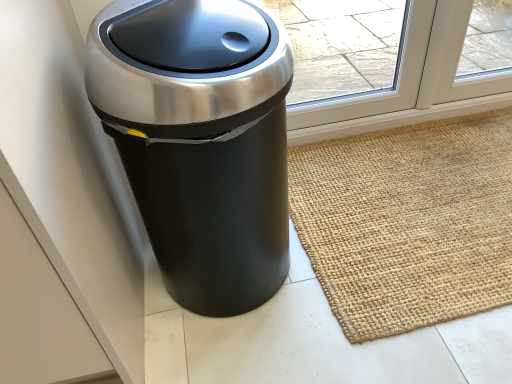
You are a GUI agent. You are given a task and a screenshot of the screen. Output one action in this format:
    pyautogui.click(x=<x>, y=<y>)
    Task: Click on the free space above natural jute doormat at lower right (from a real-world perspective)
    This screenshot has height=384, width=512.
    Given the screenshot: What is the action you would take?
    pyautogui.click(x=416, y=205)